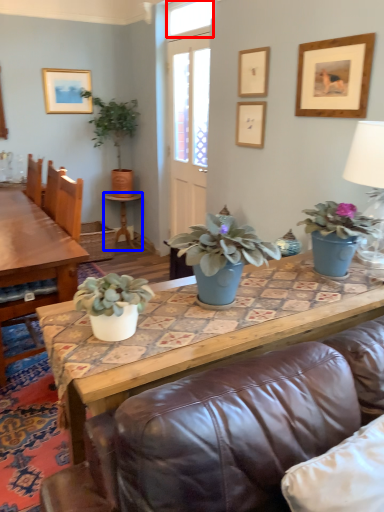
Question: Which object appears closest to the camera in this image, window (highlighted by a red box) or side table (highlighted by a blue box)?

Choices:
 (A) window
 (B) side table

Answer: (A)